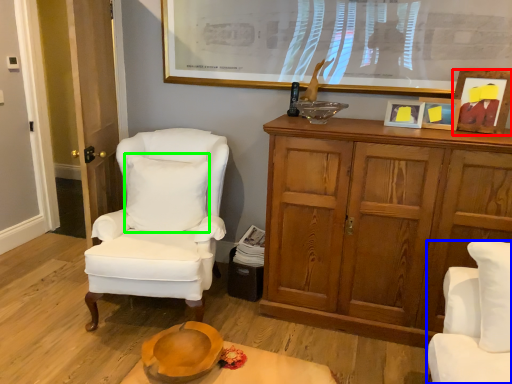
Question: Estimate the real-world distances between objects in this image. Which object is closer to picture frame (highlighted by a red box), chair (highlighted by a blue box) or pillow (highlighted by a green box)?

Choices:
 (A) chair
 (B) pillow

Answer: (A)